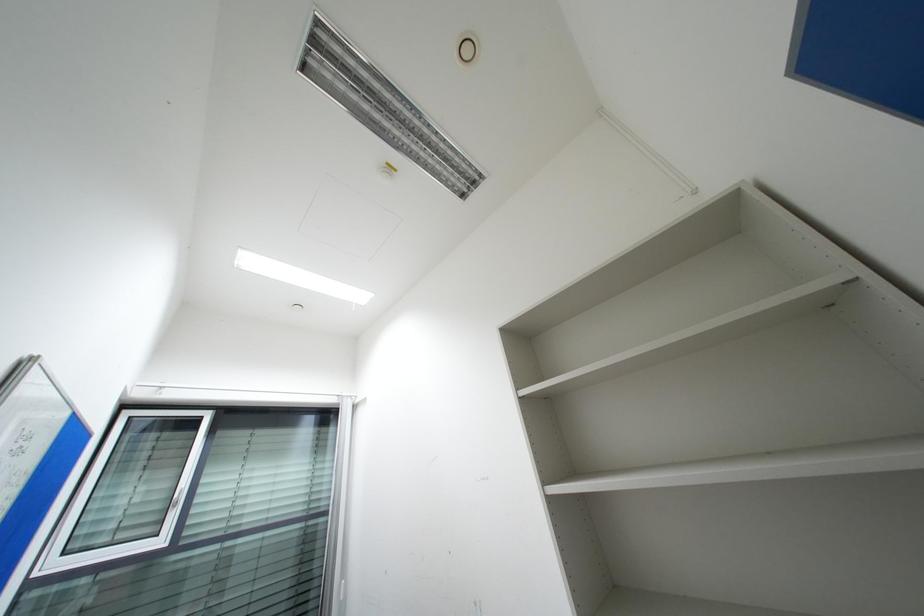
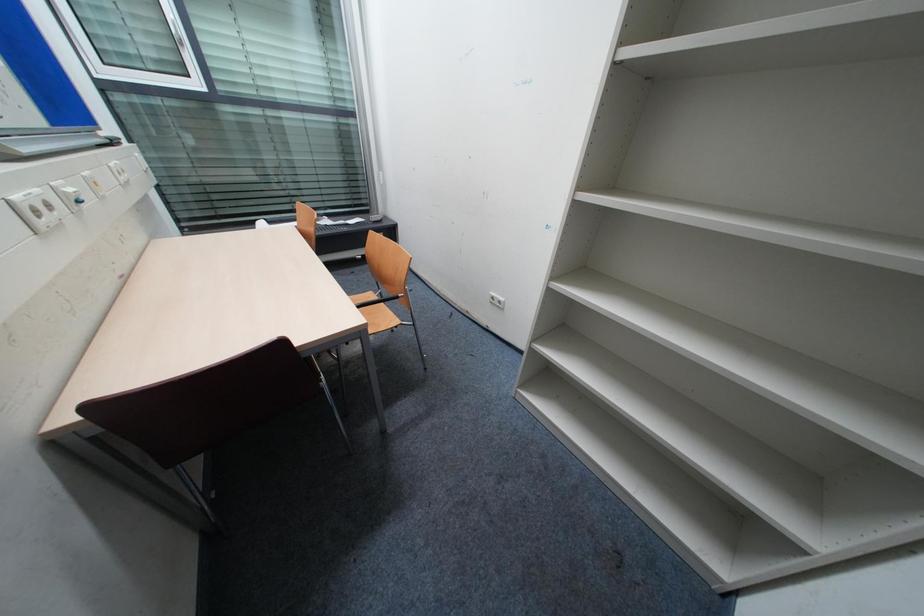
Question: The images are taken continuously from a first-person perspective. In which direction is your viewpoint rotating?

Choices:
 (A) Left
 (B) Right
 (C) Up
 (D) Down

Answer: (D)